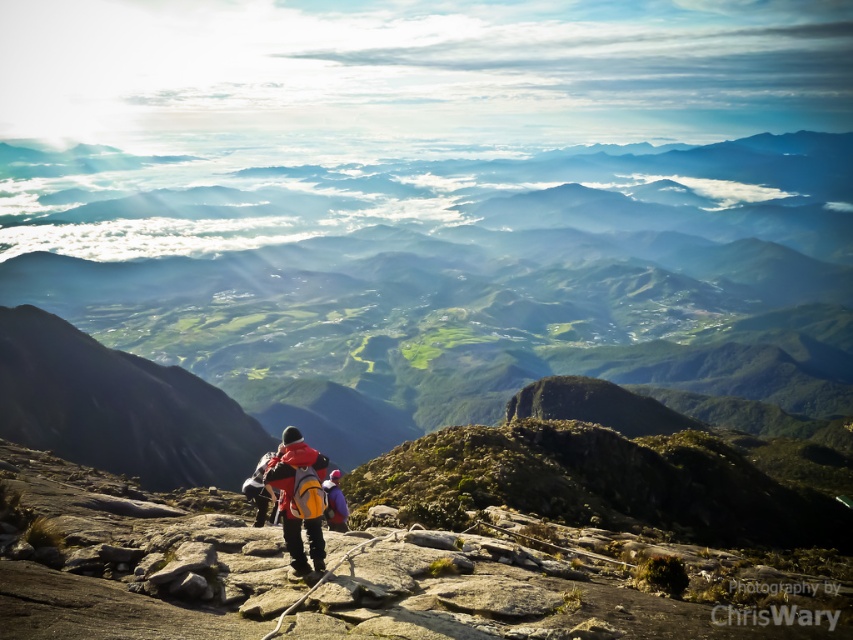
From the picture: You are a hiker who needs to pack your matte blue jacket at center into your matte orange backpack at center. Based on the scene, can you determine if the jacket will fit inside the backpack?

The matte orange backpack at center is wider than the matte blue jacket at center, so the jacket should fit inside the backpack.

You are a hiker standing at the point marked by the coordinates point (292, 497). You want to descend to the valley below. Which direction should you move relative to your current position to reach the valley?

The valley is located below the rocky foreground where you are standing, so you should move downward from your current position at point (292, 497) to reach the valley.

You are a hiker who wants to know if your matte orange backpack at center can fit into the same space as your matte blue jacket at center. Based on the scene description, can the backpack fit into the space currently occupied by the jacket?

The matte orange backpack at center occupies less space than matte blue jacket at center, so yes, the backpack can fit into the space currently occupied by the jacket.